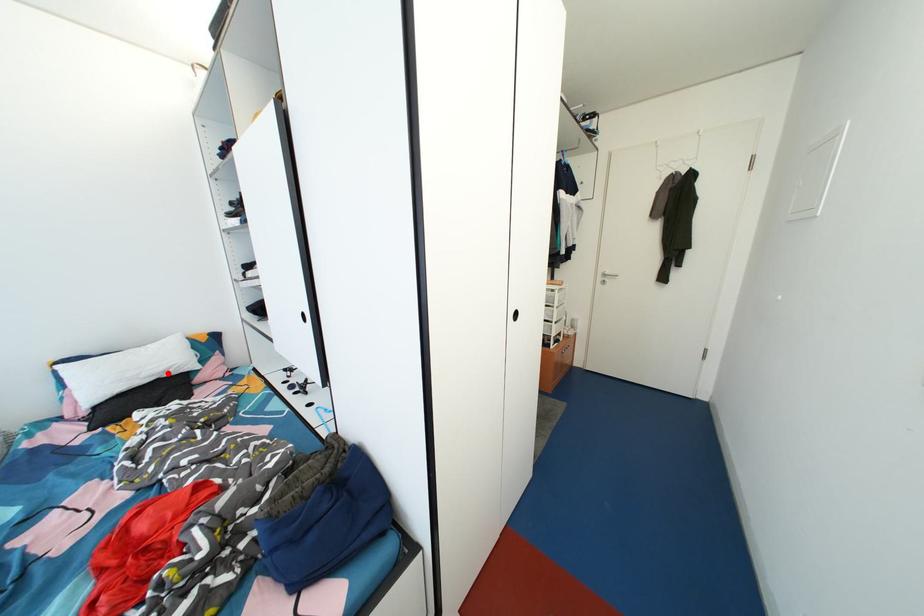
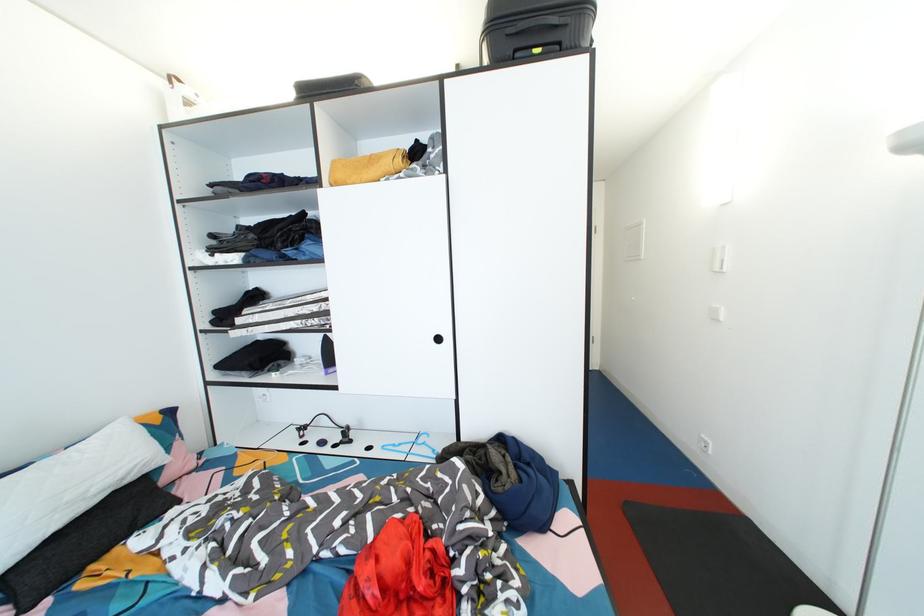
Question: I am providing you with two images of the same scene from different viewpoints. A red point is marked on the first image. Can you still see the location of the red point in image 2?

Choices:
 (A) Yes
 (B) No

Answer: (A)